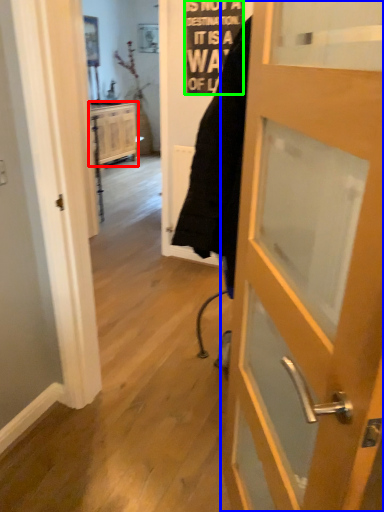
Question: Which object is the closest to the cabinetry (highlighted by a red box)? Choose among these: door (highlighted by a blue box) or writing (highlighted by a green box).

Choices:
 (A) door
 (B) writing

Answer: (B)